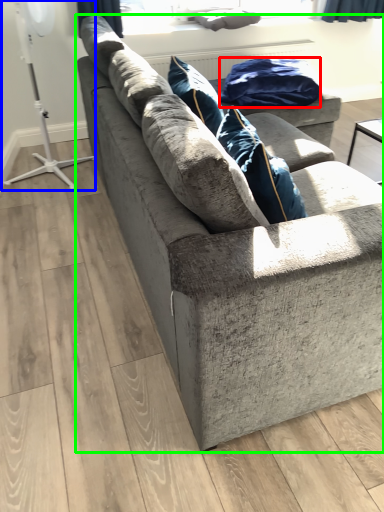
Question: Which object is positioned closest to material (highlighted by a red box)? Select from fan (highlighted by a blue box) and studio couch (highlighted by a green box).

Choices:
 (A) fan
 (B) studio couch

Answer: (B)